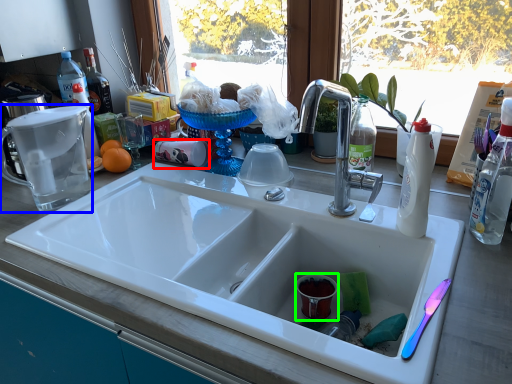
Question: Considering the real-world distances, which object is closest to coffee cup (highlighted by a red box)? appliance (highlighted by a blue box) or coffee cup (highlighted by a green box).

Choices:
 (A) appliance
 (B) coffee cup

Answer: (A)